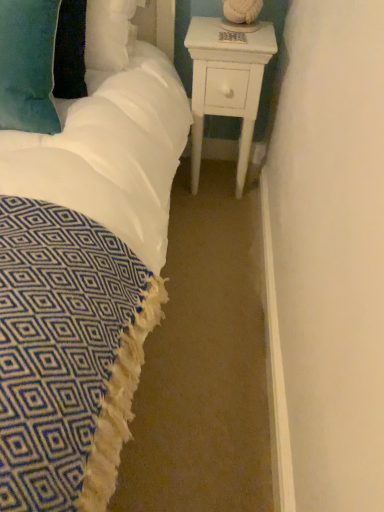
The width and height of the screenshot is (384, 512). Describe the element at coordinates (28, 65) in the screenshot. I see `velvety teal pillow at upper left` at that location.

Where is `velvety teal pillow at upper left`? velvety teal pillow at upper left is located at coordinates (28, 65).

Locate an element on the screen. The width and height of the screenshot is (384, 512). white wood nightstand at right is located at coordinates (227, 82).

What do you see at coordinates (227, 82) in the screenshot? The height and width of the screenshot is (512, 384). I see `white wood nightstand at right` at bounding box center [227, 82].

Measure the distance between point (221, 113) and camera.

They are 5.30 feet apart.

This screenshot has height=512, width=384. I want to click on velvety teal pillow at upper left, so click(x=28, y=65).

From the picture: Considering the positions of objects velvety teal pillow at upper left and white wood nightstand at right in the image provided, who is more to the right, velvety teal pillow at upper left or white wood nightstand at right?

white wood nightstand at right is more to the right.

Is velvety teal pillow at upper left in front of or behind white wood nightstand at right in the image?

Visually, velvety teal pillow at upper left is located in front of white wood nightstand at right.

Which is closer to the camera, (x=22, y=14) or (x=214, y=57)?

The point (x=22, y=14) is more forward.

From the image's perspective, who appears lower, velvety teal pillow at upper left or white wood nightstand at right?

white wood nightstand at right, from the image's perspective.

From a real-world perspective, does velvety teal pillow at upper left stand above white wood nightstand at right?

Correct, in the physical world, velvety teal pillow at upper left is higher than white wood nightstand at right.

Between velvety teal pillow at upper left and white wood nightstand at right, which one has larger width?

With larger width is velvety teal pillow at upper left.

Can you confirm if velvety teal pillow at upper left is taller than white wood nightstand at right?

No.

Considering the relative sizes of velvety teal pillow at upper left and white wood nightstand at right in the image provided, is velvety teal pillow at upper left smaller than white wood nightstand at right?

Indeed, velvety teal pillow at upper left has a smaller size compared to white wood nightstand at right.

Is velvety teal pillow at upper left located outside white wood nightstand at right?

Indeed, velvety teal pillow at upper left is completely outside white wood nightstand at right.

Is velvety teal pillow at upper left touching white wood nightstand at right?

No, velvety teal pillow at upper left is not making contact with white wood nightstand at right.

Is velvety teal pillow at upper left oriented away from white wood nightstand at right?

No.

What's the angular difference between velvety teal pillow at upper left and white wood nightstand at right's facing directions?

1.78 degrees.

Where is `nightstand behind the velvety teal pillow at upper left`? The image size is (384, 512). nightstand behind the velvety teal pillow at upper left is located at coordinates (227, 82).

Can you confirm if white wood nightstand at right is positioned to the right of velvety teal pillow at upper left?

Yes, white wood nightstand at right is to the right of velvety teal pillow at upper left.

Which object is closer to the camera, white wood nightstand at right or velvety teal pillow at upper left?

velvety teal pillow at upper left.

Between point (191, 46) and point (12, 14), which one is positioned behind?

The point (191, 46) is farther.

In the scene shown: From the image's perspective, is white wood nightstand at right on top of velvety teal pillow at upper left?

No, from the image's perspective, white wood nightstand at right is not above velvety teal pillow at upper left.

From a real-world perspective, is white wood nightstand at right physically above velvety teal pillow at upper left?

Actually, white wood nightstand at right is physically below velvety teal pillow at upper left in the real world.

Which of these two, white wood nightstand at right or velvety teal pillow at upper left, is wider?

Wider between the two is velvety teal pillow at upper left.

In terms of height, does white wood nightstand at right look taller or shorter compared to velvety teal pillow at upper left?

Clearly, white wood nightstand at right is taller compared to velvety teal pillow at upper left.

Is white wood nightstand at right smaller than velvety teal pillow at upper left?

Incorrect, white wood nightstand at right is not smaller in size than velvety teal pillow at upper left.

Is white wood nightstand at right completely or partially outside of velvety teal pillow at upper left?

Yes, white wood nightstand at right is located beyond the bounds of velvety teal pillow at upper left.

Is white wood nightstand at right placed right next to velvety teal pillow at upper left?

No, white wood nightstand at right is not next to velvety teal pillow at upper left.

Is white wood nightstand at right positioned with its back to velvety teal pillow at upper left?

white wood nightstand at right is not turned away from velvety teal pillow at upper left.

Where is `pillow that appears on the left of white wood nightstand at right`? The width and height of the screenshot is (384, 512). pillow that appears on the left of white wood nightstand at right is located at coordinates (28, 65).

Locate an element on the screen. This screenshot has width=384, height=512. pillow that is above the white wood nightstand at right (from the image's perspective) is located at coordinates (28, 65).

Identify the location of nightstand below the velvety teal pillow at upper left (from the image's perspective). (227, 82).